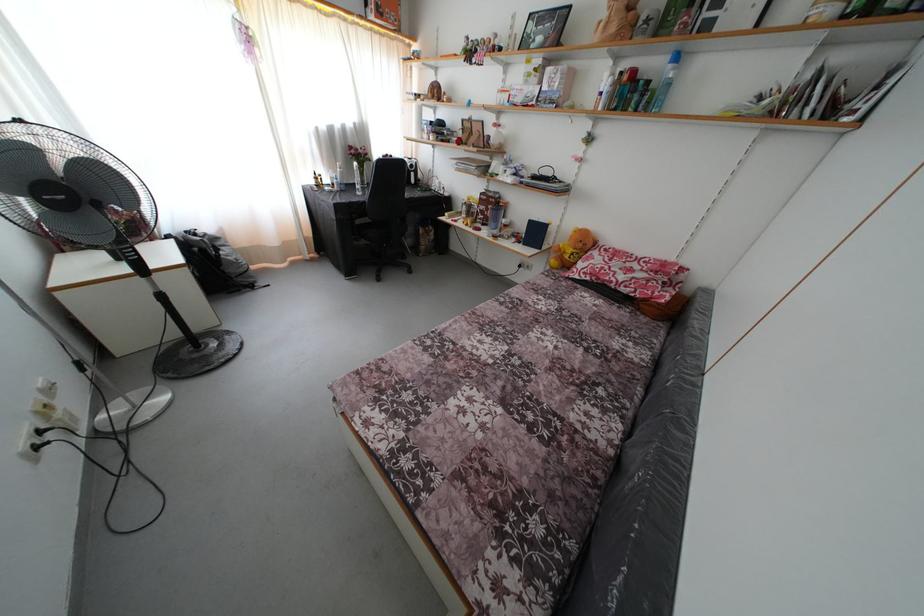
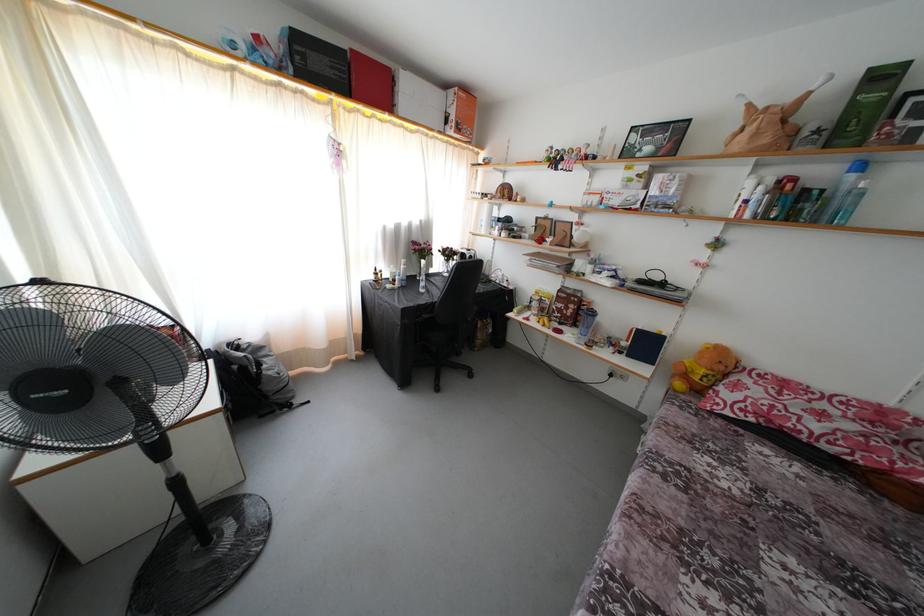
Where in the second image is the point corresponding to pixel 673 63 from the first image?

(849, 172)